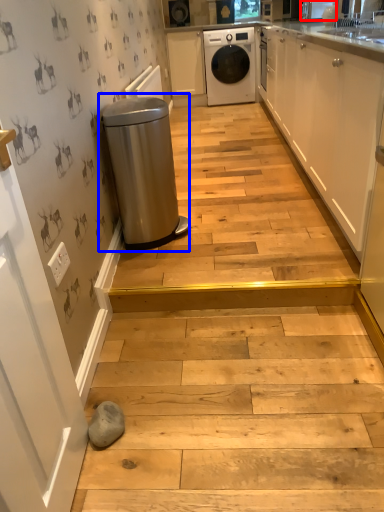
Question: Which object appears closest to the camera in this image, appliance (highlighted by a red box) or waste container (highlighted by a blue box)?

Choices:
 (A) appliance
 (B) waste container

Answer: (B)